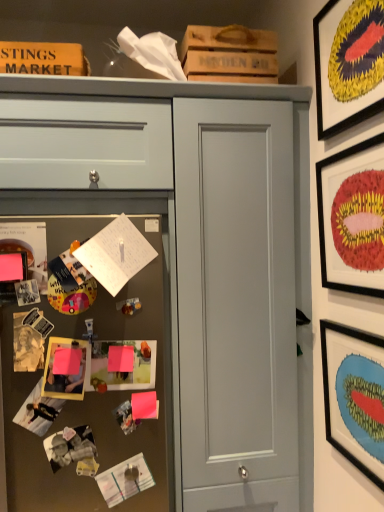
Question: Is matte gray drawer at upper left completely or partially inside matte gray door at center?

Choices:
 (A) yes
 (B) no

Answer: (B)

Question: From a real-world perspective, is matte gray door at center below matte gray drawer at upper left?

Choices:
 (A) no
 (B) yes

Answer: (B)

Question: Is matte gray door at center oriented away from matte gray drawer at upper left?

Choices:
 (A) yes
 (B) no

Answer: (B)

Question: Would you say matte gray door at center is a long distance from matte gray drawer at upper left?

Choices:
 (A) no
 (B) yes

Answer: (A)

Question: Is matte gray door at center behind matte gray drawer at upper left?

Choices:
 (A) no
 (B) yes

Answer: (B)

Question: Is matte gray door at center located outside matte gray drawer at upper left?

Choices:
 (A) no
 (B) yes

Answer: (B)

Question: Can you confirm if wooden framed artwork at upper right, marked as the 2th picture frame in a right-to-left arrangement, is taller than black matte picture frame at upper right, arranged as the 4th picture frame when viewed from the left?

Choices:
 (A) no
 (B) yes

Answer: (A)

Question: From a real-world perspective, is wooden framed artwork at upper right, the fourth picture frame positioned from the bottom, beneath black matte picture frame at upper right, the fourth picture frame from the top?

Choices:
 (A) no
 (B) yes

Answer: (A)

Question: Considering the relative positions of wooden framed artwork at upper right, the fourth picture frame positioned from the bottom, and black matte picture frame at upper right, which ranks as the 1th picture frame in right-to-left order, in the image provided, is wooden framed artwork at upper right, the fourth picture frame positioned from the bottom, to the left of black matte picture frame at upper right, which ranks as the 1th picture frame in right-to-left order, from the viewer's perspective?

Choices:
 (A) no
 (B) yes

Answer: (B)

Question: Could black matte picture frame at upper right, arranged as the 4th picture frame when viewed from the left, be considered to be inside wooden framed artwork at upper right, the fourth picture frame positioned from the bottom?

Choices:
 (A) yes
 (B) no

Answer: (B)

Question: From the image's perspective, is wooden framed artwork at upper right, marked as the 2th picture frame in a right-to-left arrangement, on top of black matte picture frame at upper right, the first picture frame positioned from the bottom?

Choices:
 (A) no
 (B) yes

Answer: (B)

Question: Is wooden framed artwork at upper right, the 1th picture frame when ordered from top to bottom, further to camera compared to black matte picture frame at upper right, the first picture frame positioned from the bottom?

Choices:
 (A) yes
 (B) no

Answer: (B)

Question: Considering the relative sizes of matte black picture frame at upper right, the 2th picture frame positioned from the left, and matte gray drawer at upper left in the image provided, is matte black picture frame at upper right, the 2th picture frame positioned from the left, bigger than matte gray drawer at upper left?

Choices:
 (A) yes
 (B) no

Answer: (B)